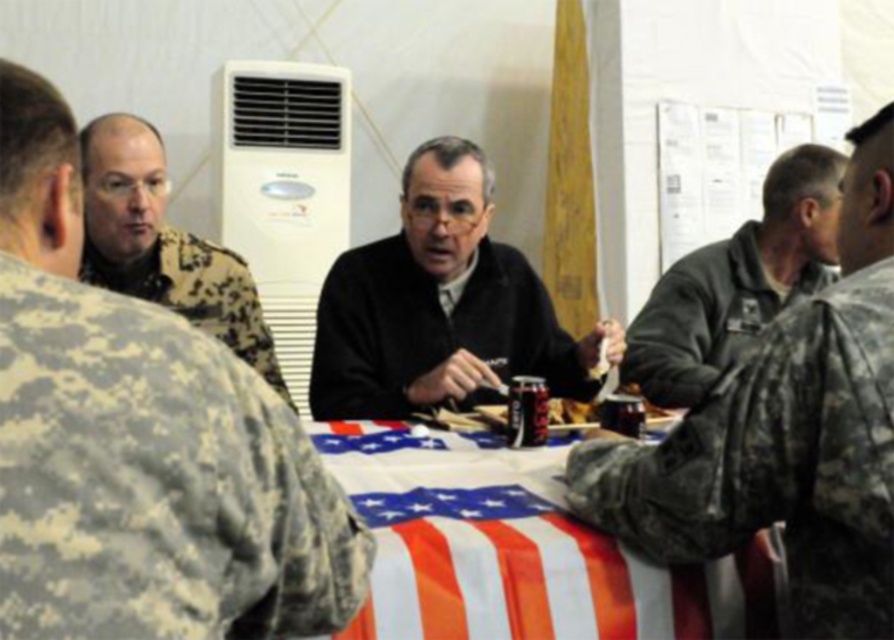
You are planning to hang a picture frame that requires 1.2 meters of clearance from the floor. You see the white plastic air conditioner at upper center and the gray matte jacket at right in the scene. Which object is positioned higher relative to the floor?

The white plastic air conditioner at upper center is taller than the gray matte jacket at right, so it is positioned higher relative to the floor.

You are a photographer taking a picture of the scene described. You want to ensure both the american flag tablecloth at center and the white plastic air conditioner at upper center are clearly visible. Based on their positions, which object will appear larger in the photo?

The american flag tablecloth at center appears larger in the photo because it is closer to the viewer than the white plastic air conditioner at upper center.

You are a soldier sitting at the table covered with an American flag in the indoor setting. You need to pass a document to the person at point (449, 472). If you are currently at point (332, 88), which direction should you move to reach them?

You should move forward because point (449, 472) is in front of point (332, 88).